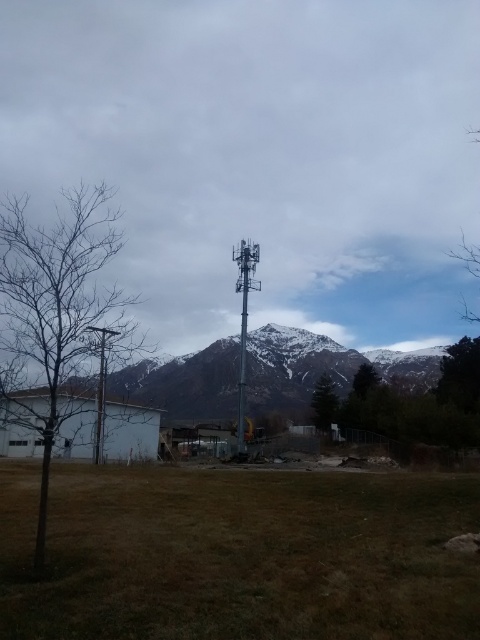
You are a bird looking for a perch. You see the bare branches at left and the metallic pole at left. Which one is higher up and would be a better spot to land?

The bare branches at left is above the metallic pole at left, so it would be a better spot to land as it is higher up.

You are a gardener who needs to plant a new tree. You have a sapling that requires 2 meters of space. Looking at the green grass at center and the bare branches at left, which area would you choose to plant the tree?

The green grass at center might be wider than the bare branches at left, so it would provide enough space for the sapling requiring 2 meters.